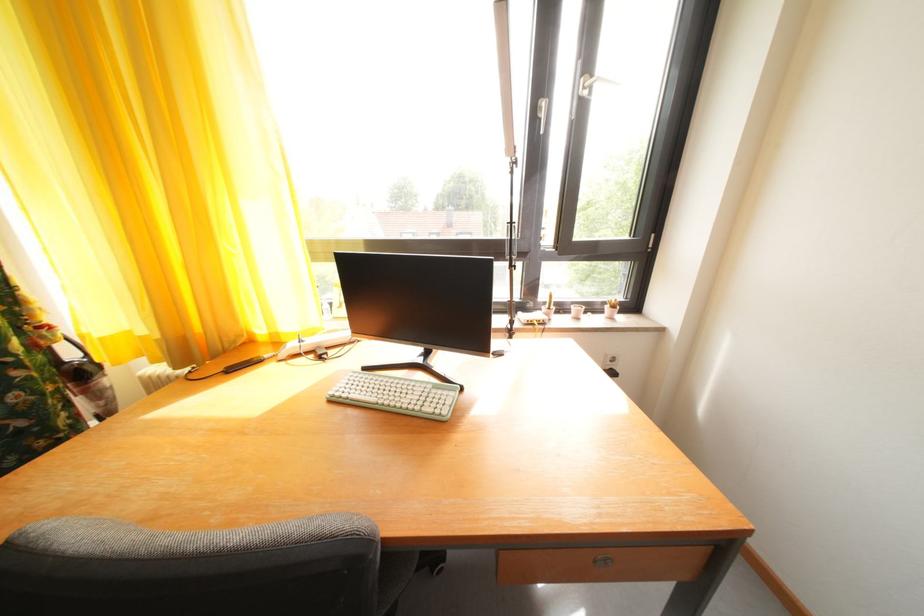
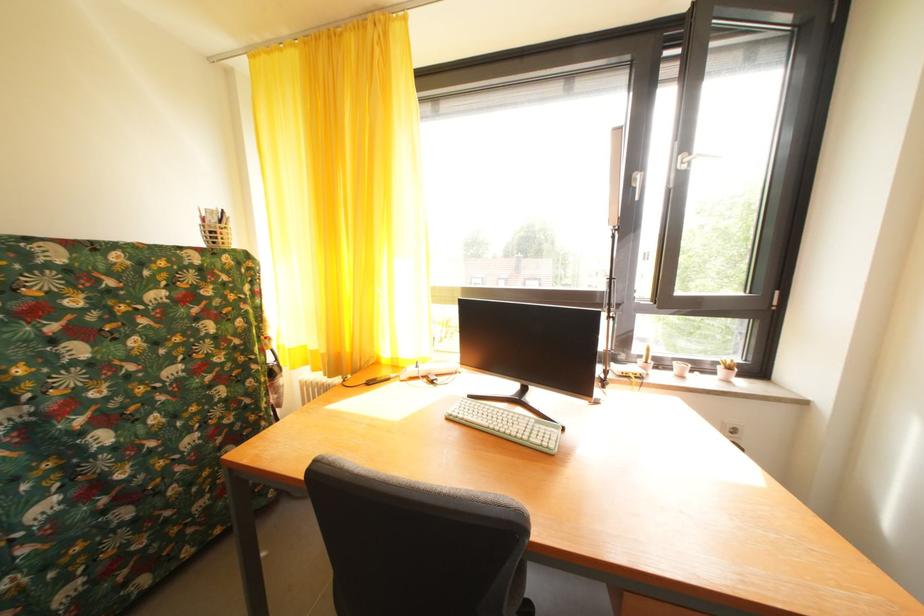
In the second image, find the point that corresponds to pixel 581 313 in the first image.

(685, 370)